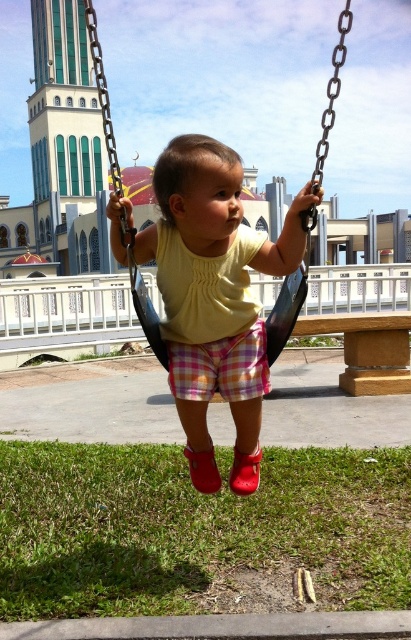
You are a park visitor standing near the swing set. You notice the yellow matte shirt at center and the black plastic swing at center. Which object is positioned lower in the image?

The yellow matte shirt at center is located below the black plastic swing at center, so it is positioned lower in the image.

You are standing at the point labeled as point (214, 296) in the image. What object are you currently standing on?

The point (214, 296) corresponds to the yellow matte shirt at center, so you are standing on the yellow matte shirt at center.

You are a park visitor observing the child on the swing. Which object, the yellow matte shirt at center or the black plastic swing at center, is closer to the ground?

The yellow matte shirt at center has a lesser height compared to the black plastic swing at center, so the yellow matte shirt at center is closer to the ground.